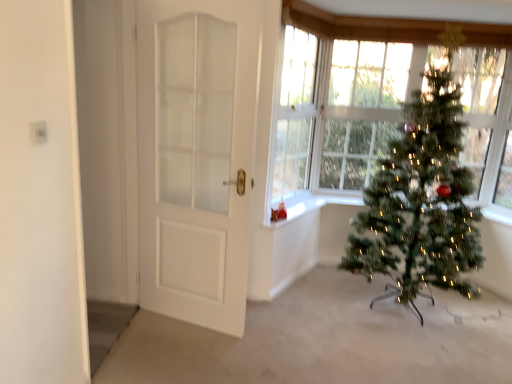
Question: Does white glossy window sill at center come in front of green artificial christmas tree at right?

Choices:
 (A) yes
 (B) no

Answer: (B)

Question: From the image's perspective, is white glossy window sill at center located above green artificial christmas tree at right?

Choices:
 (A) yes
 (B) no

Answer: (B)

Question: Can green artificial christmas tree at right be found inside white glossy window sill at center?

Choices:
 (A) yes
 (B) no

Answer: (B)

Question: Is white glossy window sill at center located outside green artificial christmas tree at right?

Choices:
 (A) yes
 (B) no

Answer: (A)

Question: From a real-world perspective, is white glossy window sill at center over green artificial christmas tree at right?

Choices:
 (A) yes
 (B) no

Answer: (B)

Question: Relative to green artificial christmas tree at right, is clear glass window at center in front or behind?

Choices:
 (A) front
 (B) behind

Answer: (B)

Question: Looking at their shapes, would you say clear glass window at center is wider or thinner than green artificial christmas tree at right?

Choices:
 (A) wide
 (B) thin

Answer: (B)

Question: Based on their sizes in the image, would you say clear glass window at center is bigger or smaller than green artificial christmas tree at right?

Choices:
 (A) big
 (B) small

Answer: (B)

Question: Would you say clear glass window at center is to the left or to the right of green artificial christmas tree at right in the picture?

Choices:
 (A) left
 (B) right

Answer: (A)

Question: Considering the positions of green artificial christmas tree at right and white glossy window sill at center in the image, is green artificial christmas tree at right taller or shorter than white glossy window sill at center?

Choices:
 (A) short
 (B) tall

Answer: (B)

Question: From the image's perspective, relative to white glossy window sill at center, is green artificial christmas tree at right above or below?

Choices:
 (A) above
 (B) below

Answer: (A)

Question: Is green artificial christmas tree at right inside the boundaries of white glossy window sill at center, or outside?

Choices:
 (A) inside
 (B) outside

Answer: (B)

Question: Is green artificial christmas tree at right wider or thinner than white glossy window sill at center?

Choices:
 (A) wide
 (B) thin

Answer: (A)

Question: Is point (287, 160) positioned closer to the camera than point (184, 145)?

Choices:
 (A) closer
 (B) farther

Answer: (B)

Question: Looking at their shapes, would you say clear glass window at center is wider or thinner than white matte door at left?

Choices:
 (A) wide
 (B) thin

Answer: (A)